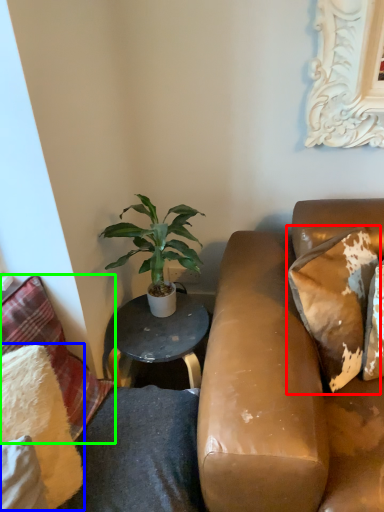
Question: Which object is the closest to the pillow (highlighted by a red box)? Choose among these: pillow (highlighted by a blue box) or pillow (highlighted by a green box).

Choices:
 (A) pillow
 (B) pillow

Answer: (B)